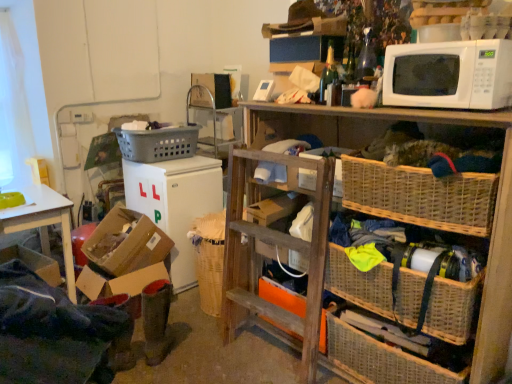
Where is `vacant area on top of woven wicker basket at lower right (from a real-world perspective)`? Image resolution: width=512 pixels, height=384 pixels. vacant area on top of woven wicker basket at lower right (from a real-world perspective) is located at coordinates (421, 248).